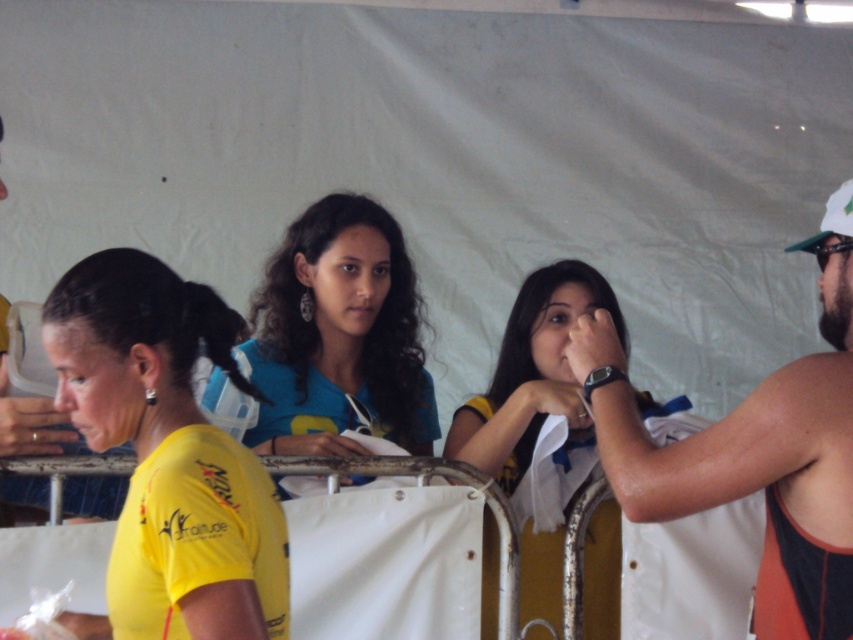
Based on the scene description, where is the orange athletic tank top at right located in terms of coordinates?

The orange athletic tank top at right is located at coordinates point (755, 452).

You are organizing a photo shoot and need to place a large prop between the blue matte shirt at center and the matte yellow shirt at left. Considering their sizes, which side of the prop should be closer to the larger shirt?

The blue matte shirt at center is bigger than the matte yellow shirt at left, so the larger side of the prop should be placed closer to the blue matte shirt at center.

You are standing in front of the group and want to greet the person wearing the blue matte shirt at center and the person wearing the matte yellow shirt at left. Which one is closer to your left side?

The matte yellow shirt at left is closer to your left side because it is positioned to the left of the blue matte shirt at center.